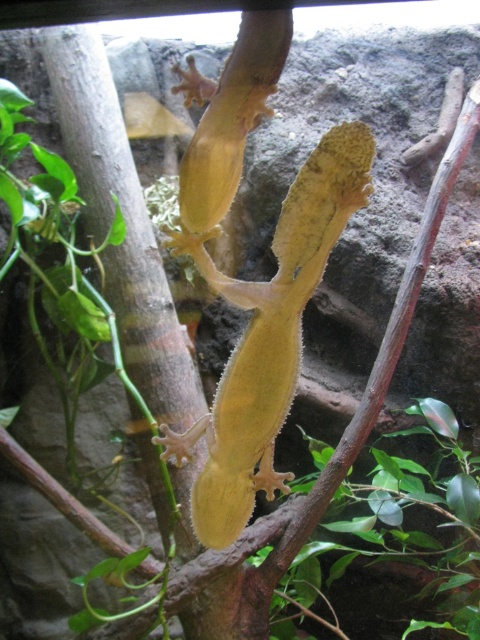
Question: From the image, what is the correct spatial relationship of yellow matte lizard at center in relation to green matte leaf at center?

Choices:
 (A) below
 (B) above

Answer: (B)

Question: Which point is closer to the camera?

Choices:
 (A) (178, 452)
 (B) (342, 552)

Answer: (A)

Question: Does yellow matte lizard at center have a larger size compared to green matte leaf at center?

Choices:
 (A) yes
 (B) no

Answer: (B)

Question: Which point is closer to the camera?

Choices:
 (A) (335, 627)
 (B) (248, 360)

Answer: (B)

Question: Can you confirm if yellow matte lizard at center is positioned to the left of green matte leaf at center?

Choices:
 (A) no
 (B) yes

Answer: (B)